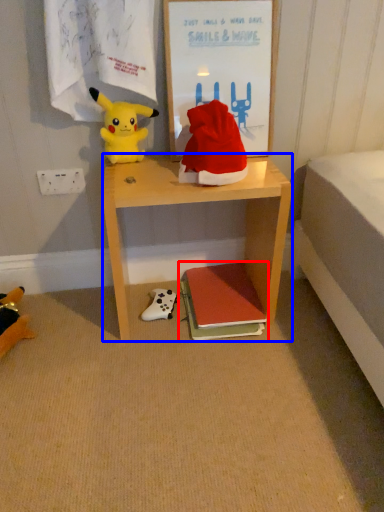
Question: Among these objects, which one is farthest to the camera, book (highlighted by a red box) or desk (highlighted by a blue box)?

Choices:
 (A) book
 (B) desk

Answer: (A)